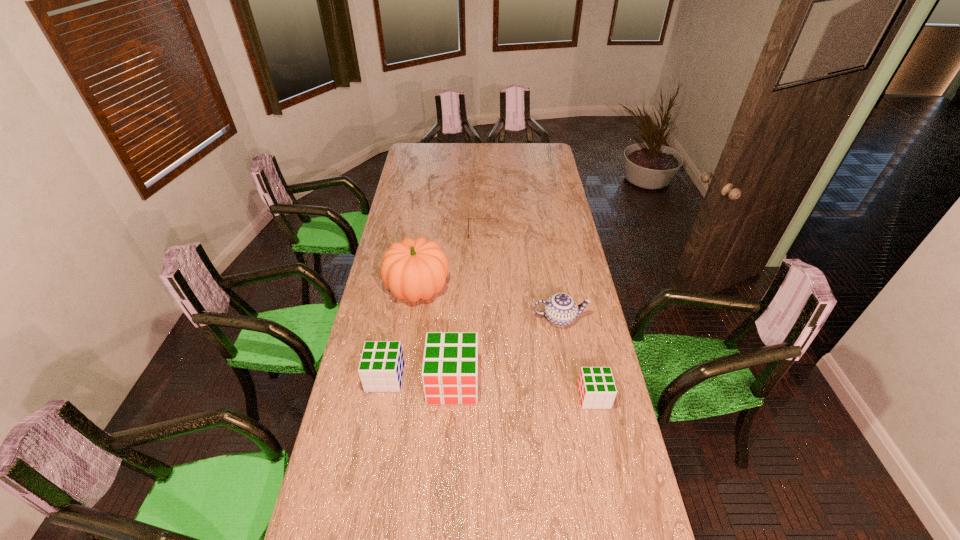
Please point a space for a new cube to maintain equal intervals. Please provide its 2D coordinates. Your answer should be formatted as a tuple, i.e. [(x, y)], where the tuple contains the x and y coordinates of a point satisfying the conditions above.

[(522, 389)]